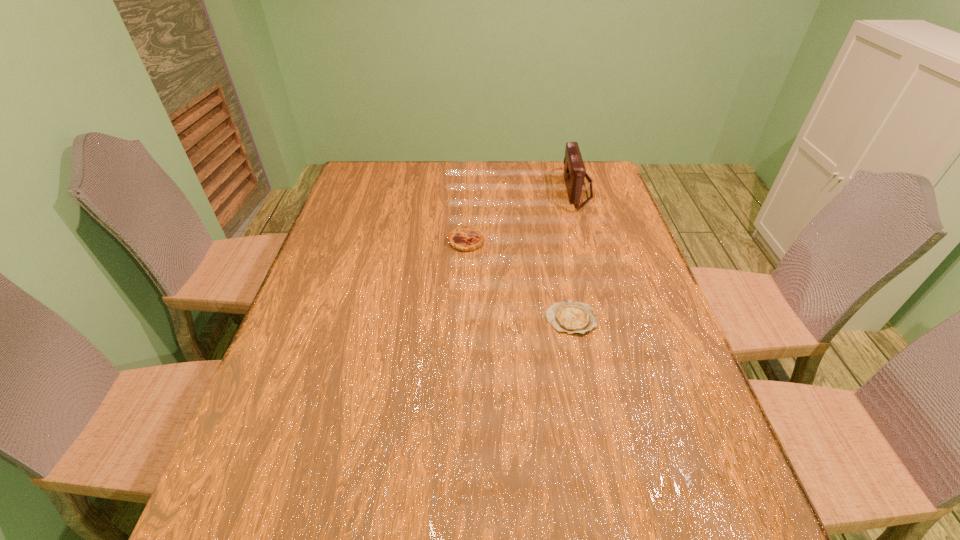
In order to click on the farthest object in this screenshot , I will do `click(574, 172)`.

You are a GUI agent. You are given a task and a screenshot of the screen. Output one action in this format:
    pyautogui.click(x=<x>, y=<y>)
    Task: Click on the rightmost object
    This screenshot has width=960, height=540.
    Given the screenshot: What is the action you would take?
    pyautogui.click(x=574, y=172)

Where is `the second shortest object`? The width and height of the screenshot is (960, 540). the second shortest object is located at coordinates (464, 238).

I want to click on the left quiche, so click(x=464, y=238).

Find the location of a particular element. the right quiche is located at coordinates [571, 317].

The height and width of the screenshot is (540, 960). Find the location of `the nearer quiche`. the nearer quiche is located at coordinates pyautogui.click(x=571, y=317).

This screenshot has height=540, width=960. I want to click on vacant space located 0.100m on the front flap of the tallest object, so click(534, 190).

Where is `free location located on the front flap of the tallest object`? This screenshot has width=960, height=540. free location located on the front flap of the tallest object is located at coordinates (488, 190).

Find the location of a particular element. The width and height of the screenshot is (960, 540). vacant space located on the front flap of the tallest object is located at coordinates (505, 190).

The height and width of the screenshot is (540, 960). What are the coordinates of `free spot located 0.160m on the left of the taller quiche` in the screenshot? It's located at (395, 241).